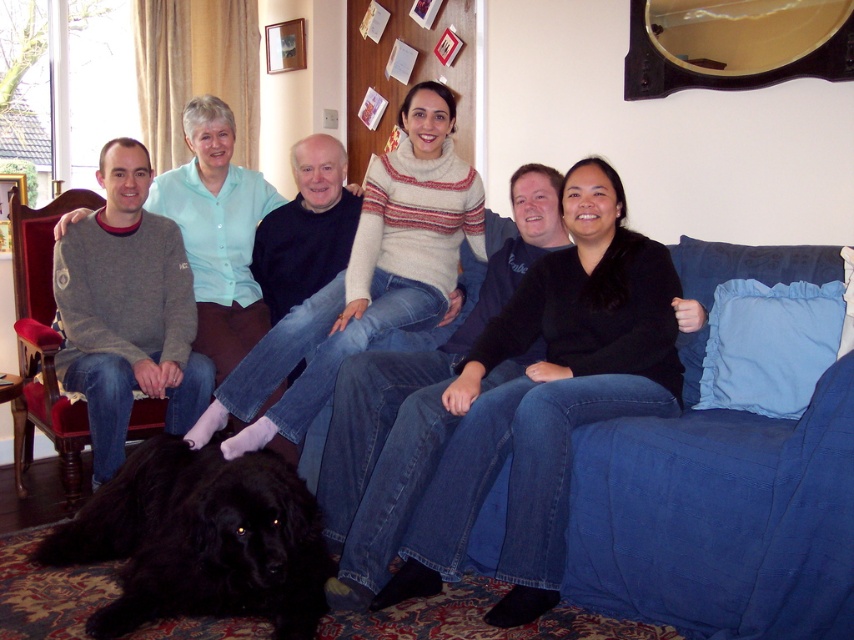
You are a photographer setting up a tripod to take a group photo of the people in the living room. You notice the matte black dog at lower left and the wooden armchair at left are both in the foreground. Which object should you move to avoid blocking the main subjects?

The matte black dog at lower left is bigger than the wooden armchair at left, so you should move the matte black dog at lower left to avoid blocking the main subjects.

You are a guest entering the living room and want to sit down. You see the matte black dog at lower left and the wooden armchair at left. Which object is closer to you as you enter the room?

The matte black dog at lower left is closer to you because it is positioned over the wooden armchair at left, indicating it is in front of the chair.